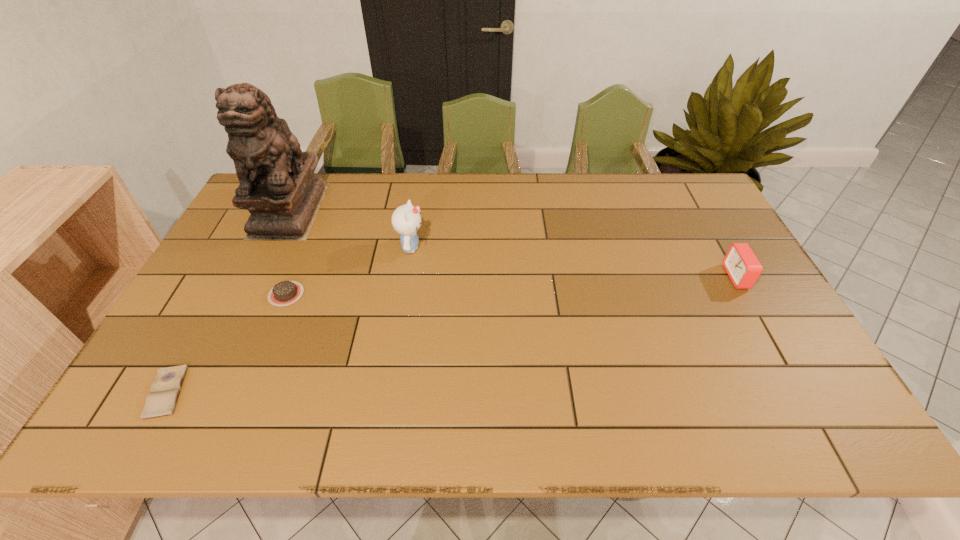
Where is `vacant space situated on the front-facing side of the third shortest object`? The width and height of the screenshot is (960, 540). vacant space situated on the front-facing side of the third shortest object is located at coordinates (616, 277).

The width and height of the screenshot is (960, 540). I want to click on free space located 0.270m on the front-facing side of the third shortest object, so click(631, 277).

Locate an element on the screen. This screenshot has height=540, width=960. vacant space situated 0.110m on the front-facing side of the third shortest object is located at coordinates (688, 277).

Locate an element on the screen. The height and width of the screenshot is (540, 960). vacant space situated on the front of the fourth tallest object is located at coordinates pos(256,366).

This screenshot has width=960, height=540. Identify the location of vacant area located on the right of the shortest object. (355, 392).

I want to click on object present at the far edge, so click(277, 186).

At what (x,y) coordinates should I click in order to perform the action: click on object that is at the near edge. Please return your answer as a coordinate pair (x, y). Looking at the image, I should click on (161, 401).

The image size is (960, 540). Identify the location of sculpture that is at the left edge. (277, 186).

Where is `diary that is at the left edge`? diary that is at the left edge is located at coordinates (161, 401).

The width and height of the screenshot is (960, 540). Identify the location of object at the right edge. (742, 266).